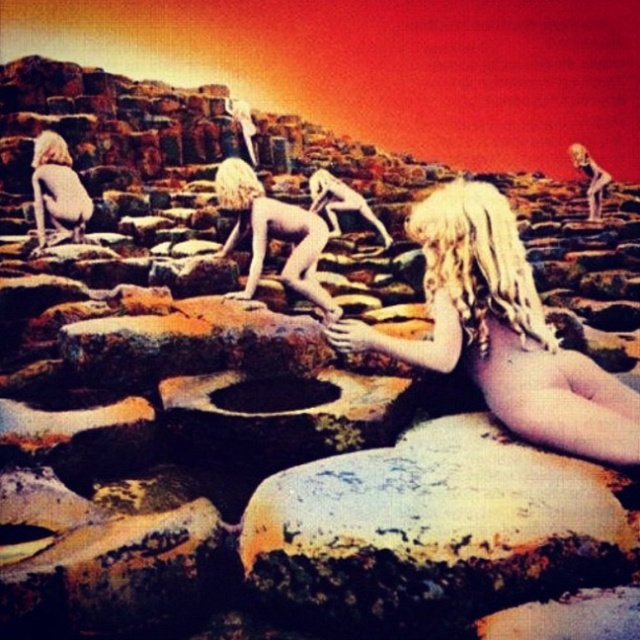
Question: Is the position of blonde hair at upper left less distant than that of blonde hair at upper right?

Choices:
 (A) no
 (B) yes

Answer: (B)

Question: Considering the relative positions of blonde hair nude girl at center and blonde hair at center in the image provided, where is blonde hair nude girl at center located with respect to blonde hair at center?

Choices:
 (A) left
 (B) right

Answer: (B)

Question: Among these points, which one is farthest from the camera?

Choices:
 (A) (513, 316)
 (B) (83, 188)

Answer: (B)

Question: Which point is closer to the camera?

Choices:
 (A) blonde hair at upper left
 (B) blonde hair at left
 (C) blonde curly hair at center
 (D) blonde hair nude girl at center

Answer: (D)

Question: Observing the image, what is the correct spatial positioning of blonde curly hair at center in reference to smooth skin girl at center?

Choices:
 (A) above
 (B) below

Answer: (B)

Question: Which object is the closest to the blonde hair at left?

Choices:
 (A) blonde curly hair at center
 (B) blonde hair at upper right

Answer: (A)